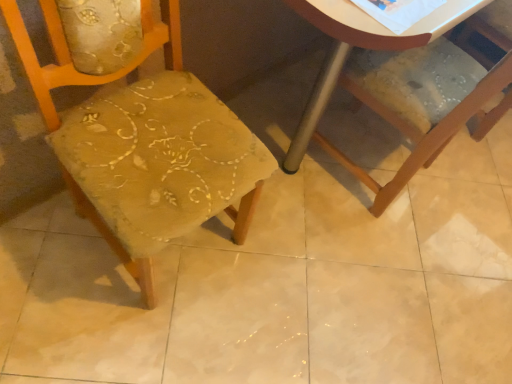
Where is `free point in front of wooden chair at lower right, which is counted as the 1th chair, starting from the right`? The image size is (512, 384). free point in front of wooden chair at lower right, which is counted as the 1th chair, starting from the right is located at coordinates (362, 264).